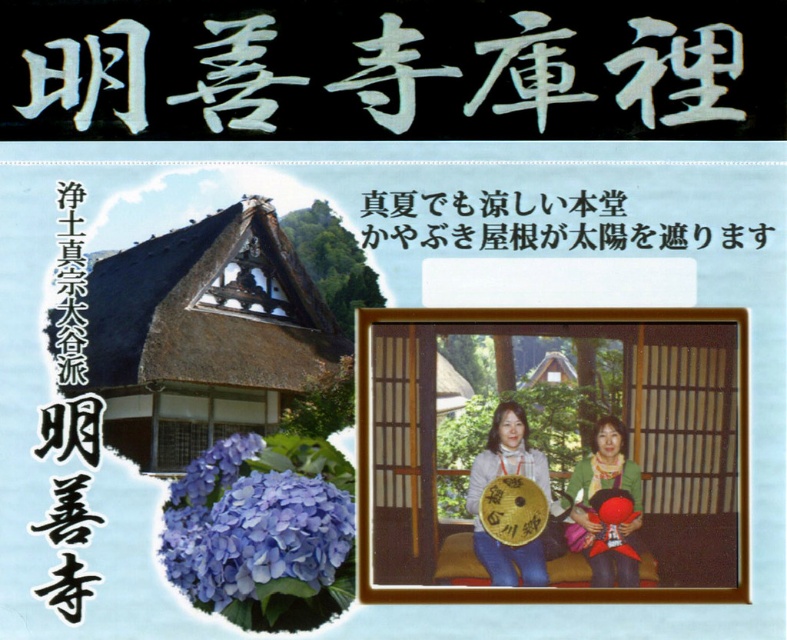
Between point (492, 428) and point (577, 544), which one is positioned behind?

Point (577, 544)

Locate an element on the screen. matte gold umbrella at center is located at coordinates pyautogui.click(x=505, y=474).

Which is in front, point (335, 326) or point (597, 486)?

Positioned in front is point (597, 486).

Which is in front, point (204, 348) or point (619, 538)?

Point (619, 538)

Image resolution: width=787 pixels, height=640 pixels. In order to click on thatched roof hut at upper left in this screenshot , I will do `click(202, 336)`.

Is black paper at upper center positioned behind green fabric jacket at center?

Yes.

Can you confirm if black paper at upper center is positioned to the right of green fabric jacket at center?

In fact, black paper at upper center is to the left of green fabric jacket at center.

The image size is (787, 640). I want to click on black paper at upper center, so click(521, 224).

Find the location of a particular element. The width and height of the screenshot is (787, 640). black paper at upper center is located at coordinates (x=521, y=224).